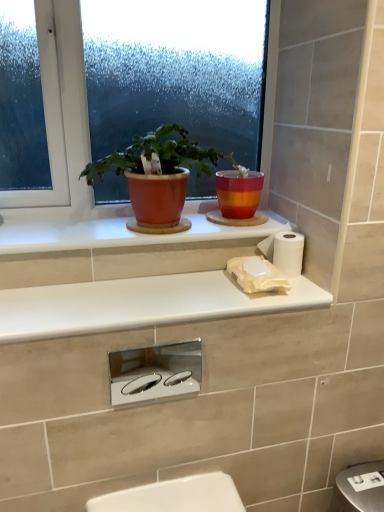
Identify the location of vacant space situated above white glossy countertop at upper center, which is the first window sill in bottom-to-top order (from a real-world perspective). pos(147,294).